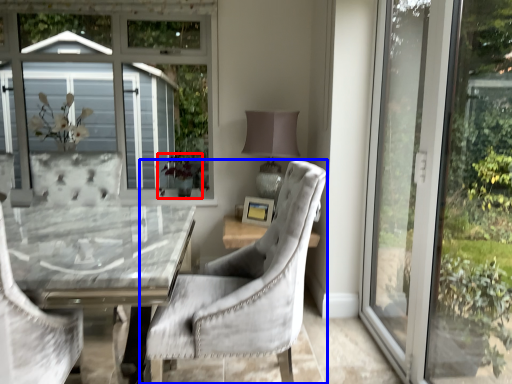
Question: Which object is further to the camera taking this photo, plant (highlighted by a red box) or chair (highlighted by a blue box)?

Choices:
 (A) plant
 (B) chair

Answer: (A)